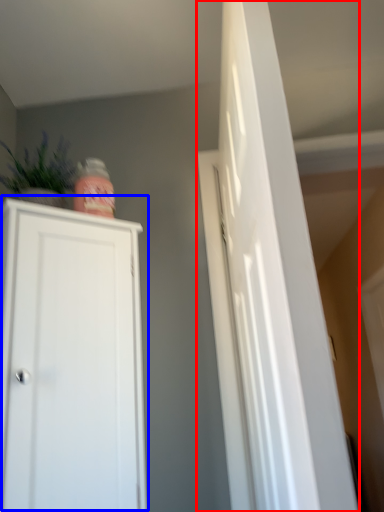
Question: Which object appears farthest to the camera in this image, door (highlighted by a red box) or cupboard (highlighted by a blue box)?

Choices:
 (A) door
 (B) cupboard

Answer: (B)